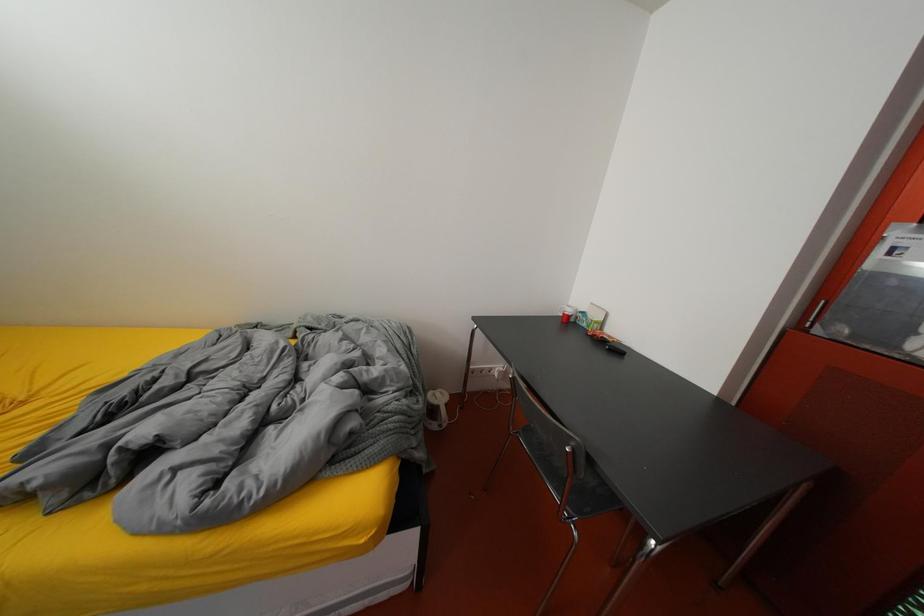
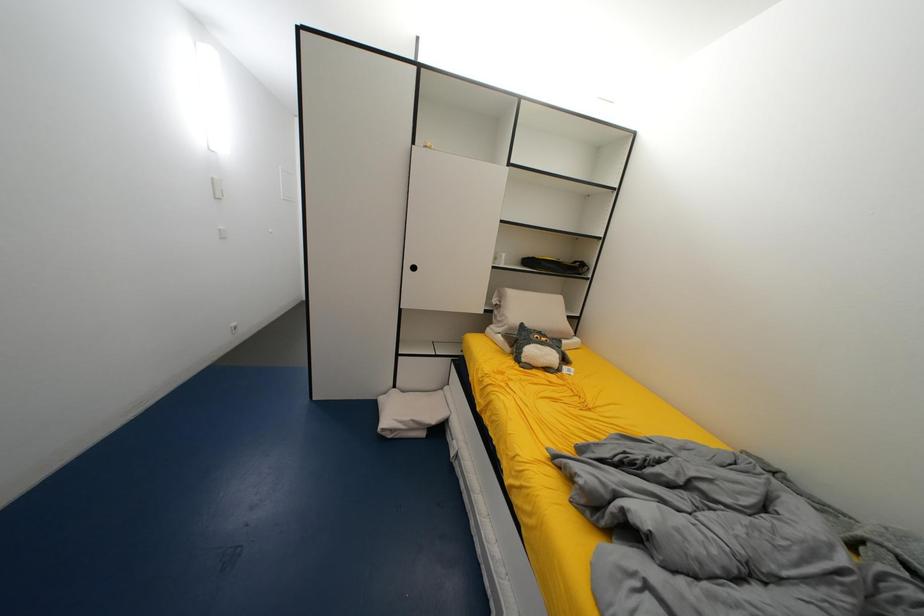
Question: How did the camera likely rotate?

Choices:
 (A) Left
 (B) Right
 (C) Up
 (D) Down

Answer: (A)